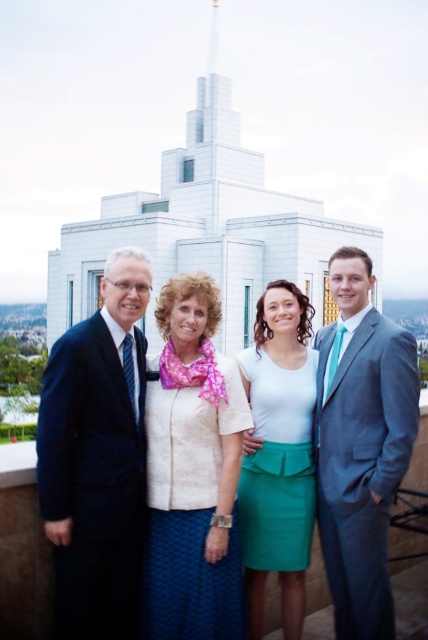
Which is more to the left, matte black suit at left or white matte shirt at center?

matte black suit at left

Who is more distant from viewer, (x=130, y=604) or (x=259, y=637)?

A: The point (x=259, y=637) is behind.

Find the location of a particular element. matte black suit at left is located at coordinates (134, 468).

Who is positioned more to the left, dark blue suit at left or white textured blouse at center?

From the viewer's perspective, dark blue suit at left appears more on the left side.

Is dark blue suit at left taller than white textured blouse at center?

Yes, dark blue suit at left is taller than white textured blouse at center.

Identify the location of dark blue suit at left. (98, 458).

Can you confirm if white textured blouse at center is wider than white matte shirt at center?

Yes.

Who is more distant from viewer, (x=157, y=516) or (x=285, y=365)?

Positioned behind is point (x=285, y=365).

Identify the location of white textured blouse at center. The image size is (428, 640). (193, 472).